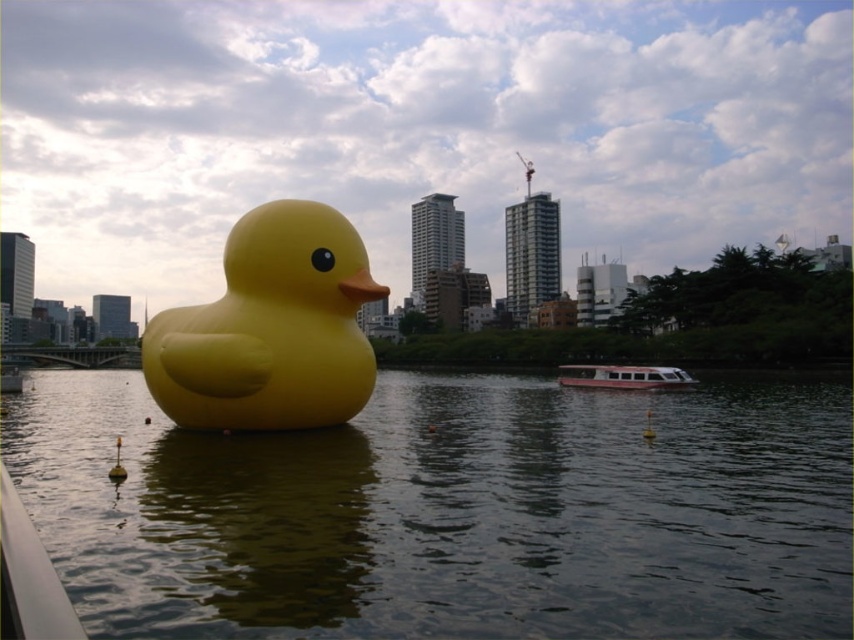
Question: Does smooth water at center appear on the left side of yellow matte rubber duck at center?

Choices:
 (A) no
 (B) yes

Answer: (B)

Question: Among these objects, which one is nearest to the camera?

Choices:
 (A) smooth water at center
 (B) yellow matte rubber duck at center

Answer: (A)

Question: Is yellow matte rubber duck at center above white glossy boat at center?

Choices:
 (A) yes
 (B) no

Answer: (A)

Question: Which point appears farthest from the camera in this image?

Choices:
 (A) (367, 492)
 (B) (372, 365)

Answer: (B)

Question: Which object is the closest to the yellow matte rubber duck at center?

Choices:
 (A) white glossy boat at center
 (B) smooth water at center

Answer: (B)

Question: Is smooth water at center smaller than yellow matte rubber duck at center?

Choices:
 (A) yes
 (B) no

Answer: (B)